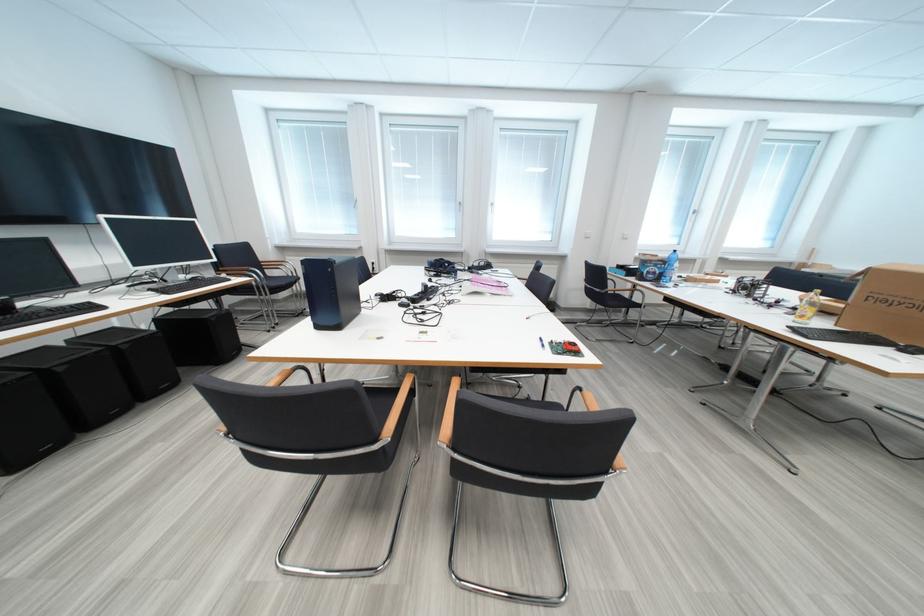
Locate an element on the screen. The width and height of the screenshot is (924, 616). dark gray chair surface is located at coordinates (399, 406).